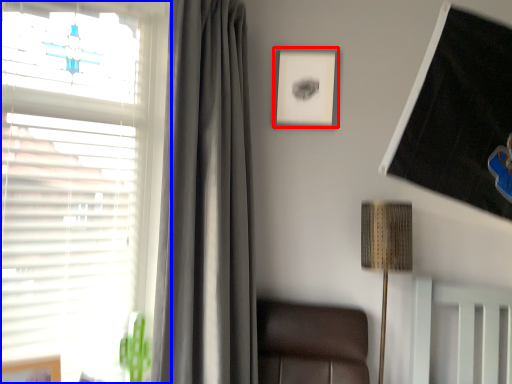
Question: Among these objects, which one is nearest to the camera, picture frame (highlighted by a red box) or window (highlighted by a blue box)?

Choices:
 (A) picture frame
 (B) window

Answer: (B)